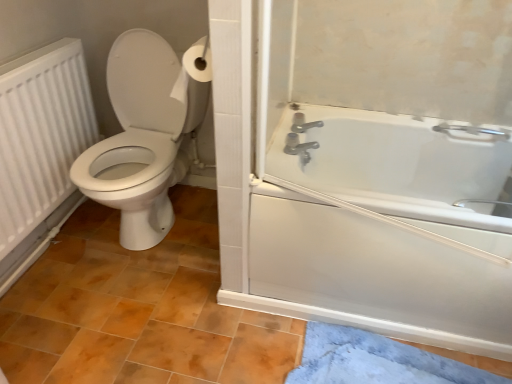
Question: From a real-world perspective, is blue plush bath mat at lower right over white matte radiator at left?

Choices:
 (A) yes
 (B) no

Answer: (B)

Question: Could white matte radiator at left be considered to be inside blue plush bath mat at lower right?

Choices:
 (A) no
 (B) yes

Answer: (A)

Question: Is blue plush bath mat at lower right bigger than white matte radiator at left?

Choices:
 (A) no
 (B) yes

Answer: (A)

Question: Considering the relative sizes of blue plush bath mat at lower right and white matte radiator at left in the image provided, is blue plush bath mat at lower right smaller than white matte radiator at left?

Choices:
 (A) yes
 (B) no

Answer: (A)

Question: Is blue plush bath mat at lower right thinner than white matte radiator at left?

Choices:
 (A) no
 (B) yes

Answer: (A)

Question: From a real-world perspective, is white matte radiator at left positioned above or below white glossy toilet at left?

Choices:
 (A) above
 (B) below

Answer: (A)

Question: In terms of height, does white matte radiator at left look taller or shorter compared to white glossy toilet at left?

Choices:
 (A) tall
 (B) short

Answer: (B)

Question: From the image's perspective, is white matte radiator at left above or below white glossy toilet at left?

Choices:
 (A) above
 (B) below

Answer: (B)

Question: Does point (23, 102) appear closer or farther from the camera than point (181, 175)?

Choices:
 (A) farther
 (B) closer

Answer: (B)

Question: Is white matte radiator at left taller or shorter than brown matte tile at lower center?

Choices:
 (A) short
 (B) tall

Answer: (B)

Question: Based on their sizes in the image, would you say white matte radiator at left is bigger or smaller than brown matte tile at lower center?

Choices:
 (A) big
 (B) small

Answer: (B)

Question: From the image's perspective, is white matte radiator at left located above or below brown matte tile at lower center?

Choices:
 (A) below
 (B) above

Answer: (B)

Question: In the image, is white matte radiator at left on the left side or the right side of brown matte tile at lower center?

Choices:
 (A) right
 (B) left

Answer: (B)

Question: Is blue plush bath mat at lower right wider or thinner than brown matte tile at lower center?

Choices:
 (A) thin
 (B) wide

Answer: (A)

Question: Relative to brown matte tile at lower center, is blue plush bath mat at lower right in front or behind?

Choices:
 (A) behind
 (B) front

Answer: (A)